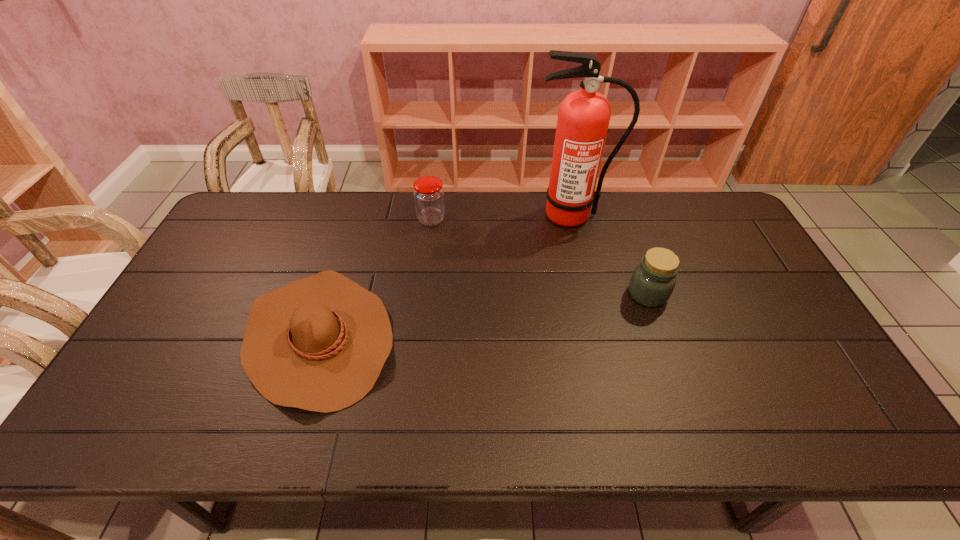
Where is `fire extinguisher that is at the far edge`? fire extinguisher that is at the far edge is located at coordinates (583, 118).

Locate an element on the screen. This screenshot has height=540, width=960. jar positioned at the far edge is located at coordinates (429, 199).

Where is `object at the near edge`? object at the near edge is located at coordinates (319, 344).

The height and width of the screenshot is (540, 960). I want to click on free space at the far edge of the desktop, so click(347, 197).

The width and height of the screenshot is (960, 540). Identify the location of vacant space at the near edge of the desktop. (331, 428).

This screenshot has height=540, width=960. What are the coordinates of `free region at the left edge of the desktop` in the screenshot? It's located at (170, 365).

At what (x,y) coordinates should I click in order to perform the action: click on free space at the right edge of the desktop. Please return your answer as a coordinate pair (x, y). This screenshot has width=960, height=540. Looking at the image, I should click on click(x=774, y=305).

In the image, there is a desktop. Identify the location of blank space at the near left corner. (86, 442).

Find the location of a particular element. The width and height of the screenshot is (960, 540). vacant space at the far right corner of the desktop is located at coordinates (717, 205).

The width and height of the screenshot is (960, 540). Identify the location of free space between the tallest object and the right jar. (610, 255).